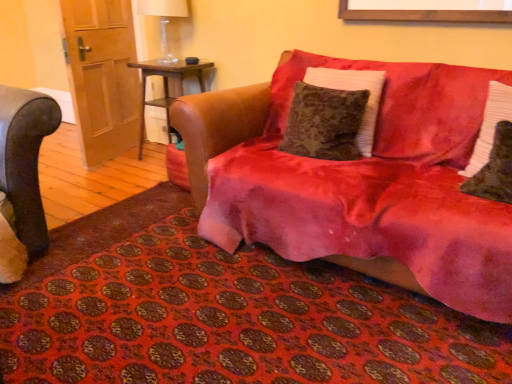
Question: Is there a large distance between velvet red couch at center and white textured pillow at right, which ranks as the third pillow in left-to-right order?

Choices:
 (A) no
 (B) yes

Answer: (A)

Question: Considering the relative sizes of velvet red couch at center and white textured pillow at right, which ranks as the third pillow in left-to-right order, in the image provided, is velvet red couch at center shorter than white textured pillow at right, which ranks as the third pillow in left-to-right order,?

Choices:
 (A) no
 (B) yes

Answer: (A)

Question: Does velvet red couch at center have a smaller size compared to white textured pillow at right, which ranks as the third pillow in left-to-right order?

Choices:
 (A) no
 (B) yes

Answer: (A)

Question: From a real-world perspective, is velvet red couch at center on top of white textured pillow at right, which ranks as the third pillow in left-to-right order?

Choices:
 (A) yes
 (B) no

Answer: (B)

Question: Considering the relative sizes of velvet red couch at center and white textured pillow at right, positioned as the first pillow in right-to-left order, in the image provided, is velvet red couch at center wider than white textured pillow at right, positioned as the first pillow in right-to-left order,?

Choices:
 (A) no
 (B) yes

Answer: (B)

Question: In the image, is velvet red couch at center positioned in front of or behind wooden door at left?

Choices:
 (A) front
 (B) behind

Answer: (A)

Question: Considering the relative positions of velvet red couch at center and wooden door at left in the image provided, is velvet red couch at center to the left or to the right of wooden door at left?

Choices:
 (A) left
 (B) right

Answer: (B)

Question: In terms of width, does velvet red couch at center look wider or thinner when compared to wooden door at left?

Choices:
 (A) thin
 (B) wide

Answer: (B)

Question: From a real-world perspective, is velvet red couch at center positioned above or below wooden door at left?

Choices:
 (A) below
 (B) above

Answer: (A)

Question: Do you think white textured pillow at right, which ranks as the third pillow in left-to-right order, is within velvet red mat at lower center, or outside of it?

Choices:
 (A) outside
 (B) inside

Answer: (A)

Question: Considering the positions of white textured pillow at right, which ranks as the third pillow in left-to-right order, and velvet red mat at lower center in the image, is white textured pillow at right, which ranks as the third pillow in left-to-right order, taller or shorter than velvet red mat at lower center?

Choices:
 (A) short
 (B) tall

Answer: (B)

Question: From a real-world perspective, is white textured pillow at right, positioned as the first pillow in right-to-left order, positioned above or below velvet red mat at lower center?

Choices:
 (A) below
 (B) above

Answer: (B)

Question: Looking at their shapes, would you say white textured pillow at right, which ranks as the third pillow in left-to-right order, is wider or thinner than velvet red mat at lower center?

Choices:
 (A) thin
 (B) wide

Answer: (A)

Question: Choose the correct answer: Is velvet red mat at lower center inside wooden door at left or outside it?

Choices:
 (A) outside
 (B) inside

Answer: (A)

Question: Considering the positions of velvet red mat at lower center and wooden door at left in the image, is velvet red mat at lower center wider or thinner than wooden door at left?

Choices:
 (A) wide
 (B) thin

Answer: (A)